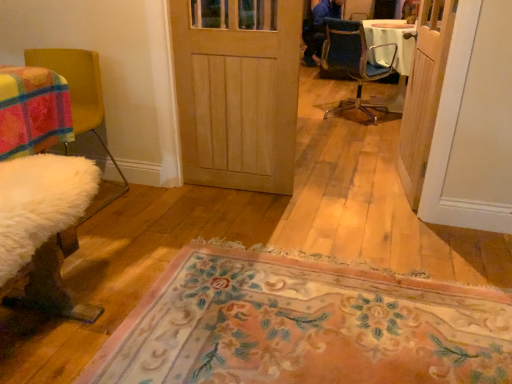
Question: In which direction should I rotate to look at natural wood door at center, which appears as the second door when viewed from the right?

Choices:
 (A) left
 (B) right

Answer: (A)

Question: Considering the relative sizes of natural wood door at center, which appears as the second door when viewed from the right, and white fluffy chair at left, the first chair viewed from the left, in the image provided, is natural wood door at center, which appears as the second door when viewed from the right, bigger than white fluffy chair at left, the first chair viewed from the left,?

Choices:
 (A) no
 (B) yes

Answer: (A)

Question: Is natural wood door at center, which appears as the second door when viewed from the right, outside of white fluffy chair at left, which is the second chair from top to bottom?

Choices:
 (A) no
 (B) yes

Answer: (B)

Question: Does natural wood door at center, positioned as the first door in left-to-right order, appear on the right side of white fluffy chair at left, the first chair when ordered from front to back?

Choices:
 (A) yes
 (B) no

Answer: (A)

Question: Is natural wood door at center, positioned as the first door in left-to-right order, in front of white fluffy chair at left, which is the second chair from top to bottom?

Choices:
 (A) no
 (B) yes

Answer: (A)

Question: Is white fluffy chair at left, arranged as the second chair when viewed from the back, surrounded by natural wood door at center, which appears as the second door when viewed from the right?

Choices:
 (A) no
 (B) yes

Answer: (A)

Question: Is natural wood door at center, which appears as the second door when viewed from the right, to the left of white fluffy chair at left, the first chair when ordered from front to back, from the viewer's perspective?

Choices:
 (A) yes
 (B) no

Answer: (B)

Question: Is white fluffy chair at left, which appears as the first chair when ordered from the bottom, surrounded by floral carpet at center?

Choices:
 (A) yes
 (B) no

Answer: (B)

Question: Does floral carpet at center lie in front of white fluffy chair at left, which is counted as the second chair, starting from the right?

Choices:
 (A) yes
 (B) no

Answer: (A)

Question: Is floral carpet at center oriented towards white fluffy chair at left, which is counted as the second chair, starting from the right?

Choices:
 (A) no
 (B) yes

Answer: (A)

Question: From the image's perspective, would you say floral carpet at center is positioned over white fluffy chair at left, the first chair when ordered from front to back?

Choices:
 (A) no
 (B) yes

Answer: (A)

Question: Is floral carpet at center wider than white fluffy chair at left, which is the second chair from top to bottom?

Choices:
 (A) no
 (B) yes

Answer: (B)

Question: Does floral carpet at center have a larger size compared to white fluffy chair at left, arranged as the second chair when viewed from the back?

Choices:
 (A) yes
 (B) no

Answer: (B)

Question: Could you tell me if natural wood door at center, which appears as the second door when viewed from the right, is facing floral carpet at center?

Choices:
 (A) yes
 (B) no

Answer: (A)